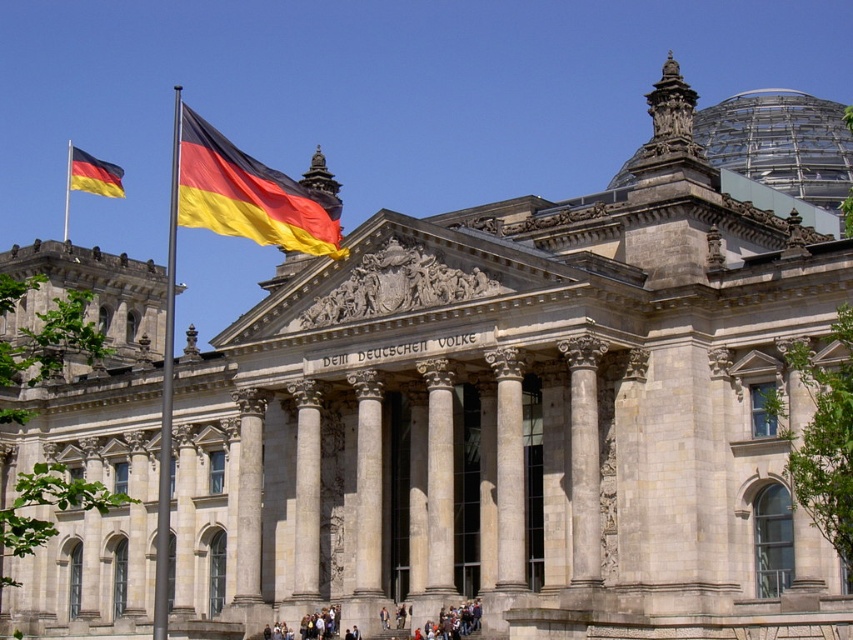
Can you confirm if yellow-red-black fabric flag at center is positioned above matte yellow and black flag at upper left?

No.

Can you confirm if yellow-red-black fabric flag at center is wider than matte yellow and black flag at upper left?

No, yellow-red-black fabric flag at center is not wider than matte yellow and black flag at upper left.

Is point (337, 221) less distant than point (114, 177)?

Yes, point (337, 221) is in front of point (114, 177).

Find the location of `yellow-red-black fabric flag at center`. yellow-red-black fabric flag at center is located at coordinates 248,195.

Which is more to the right, matte yellow and black flag at upper left or metallic flag pole at left?

From the viewer's perspective, matte yellow and black flag at upper left appears more on the right side.

Is matte yellow and black flag at upper left bigger than metallic flag pole at left?

Yes, matte yellow and black flag at upper left is bigger than metallic flag pole at left.

Find the location of a particular element. matte yellow and black flag at upper left is located at coordinates (93, 173).

The height and width of the screenshot is (640, 853). I want to click on matte yellow and black flag at upper left, so click(93, 173).

Can you confirm if yellow-red-black fabric flag at center is smaller than metallic flag pole at left?

Correct, yellow-red-black fabric flag at center occupies less space than metallic flag pole at left.

Is the position of yellow-red-black fabric flag at center less distant than that of metallic flag pole at left?

Yes, yellow-red-black fabric flag at center is in front of metallic flag pole at left.

The image size is (853, 640). In order to click on yellow-red-black fabric flag at center in this screenshot , I will do `click(248, 195)`.